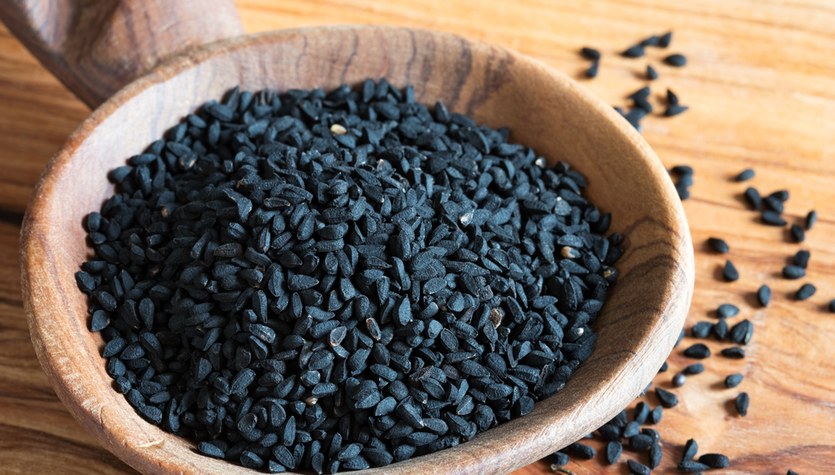
Where is `wood bowl`? wood bowl is located at coordinates click(638, 203).